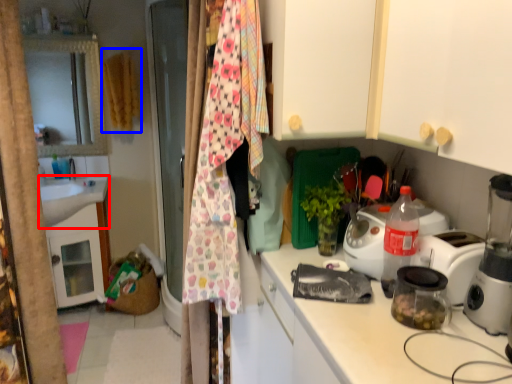
Question: Which point is closer to the camera, sink (highlighted by a red box) or clothesline (highlighted by a blue box)?

Choices:
 (A) sink
 (B) clothesline

Answer: (A)